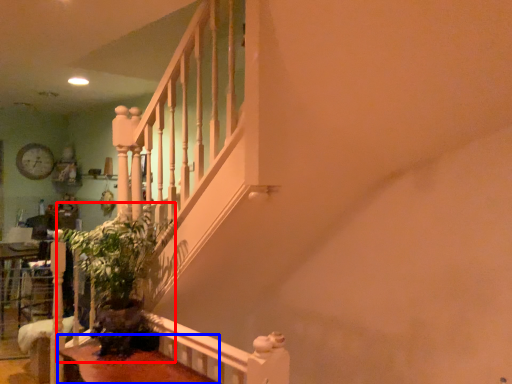
Question: Which object is further to the camera taking this photo, plant (highlighted by a red box) or table (highlighted by a blue box)?

Choices:
 (A) plant
 (B) table

Answer: (A)